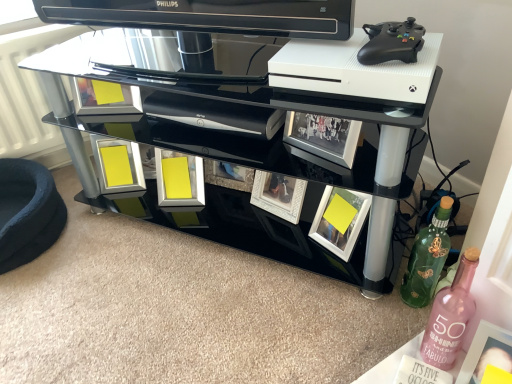
Question: From a real-world perspective, relative to metallic silver picture frame at center, the second picture frame in the left-to-right sequence, is green matte bottle at lower right, acting as the second bottle starting from the front, vertically above or below?

Choices:
 (A) above
 (B) below

Answer: (B)

Question: Considering the positions of point (432, 256) and point (105, 109), is point (432, 256) closer or farther from the camera than point (105, 109)?

Choices:
 (A) farther
 (B) closer

Answer: (B)

Question: Considering the real-world distances, which object is closest to the yellow matte picture frame at lower right, the 2th picture frame when ordered from right to left?

Choices:
 (A) black glass tv stand at center
 (B) white glossy magazine at lower right
 (C) metallic silver picture frame at center, which is the 4th picture frame from right to left
 (D) matte yellow picture frame at lower center, acting as the 3th picture frame starting from the right
 (E) velvet cushion at lower left

Answer: (A)

Question: Which is nearer to the metallic silver picture frame at center, positioned as the third picture frame in front-to-back order?

Choices:
 (A) green matte bottle at lower right, the first bottle viewed from the back
 (B) pink glass bottle at lower right, which is counted as the second bottle, starting from the back
 (C) matte yellow picture frame at lower center, positioned as the 2th picture frame in back-to-front order
 (D) yellow matte picture frame at lower right, which ranks as the second picture frame in front-to-back order
 (E) black glass tv stand at center

Answer: (C)